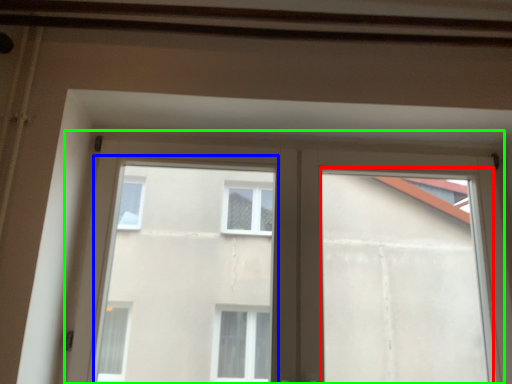
Question: Based on their relative distances, which object is farther from window frame (highlighted by a red box)? Choose from bay window (highlighted by a blue box) and window (highlighted by a green box).

Choices:
 (A) bay window
 (B) window

Answer: (A)